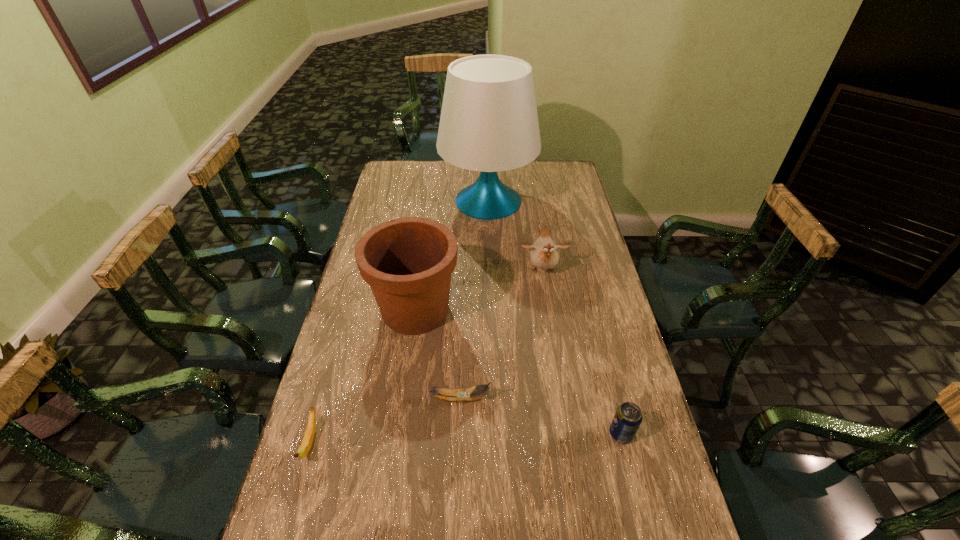
At what (x,y) coordinates should I click in order to perform the action: click on vacant point located between the fourth tallest object and the right banana. Please return your answer as a coordinate pair (x, y). This screenshot has width=960, height=540. Looking at the image, I should click on 540,416.

Identify the location of free space between the fifth shortest object and the left banana. The image size is (960, 540). (363, 376).

This screenshot has height=540, width=960. I want to click on vacant space that is in between the leftmost object and the bird, so click(426, 357).

This screenshot has height=540, width=960. What are the coordinates of `vacant area that lies between the bird and the fourth tallest object` in the screenshot? It's located at (582, 353).

The height and width of the screenshot is (540, 960). I want to click on vacant region between the shortest object and the fourth shortest object, so click(426, 357).

Where is `object that stands as the fifth closest to the tallest object`? object that stands as the fifth closest to the tallest object is located at coordinates (306, 444).

Choose which object is the nearest neighbor to the shorter banana. Please provide its 2D coordinates. Your answer should be formatted as a tuple, i.e. [(x, y)], where the tuple contains the x and y coordinates of a point satisfying the conditions above.

[(408, 262)]

This screenshot has height=540, width=960. I want to click on vacant point that satisfies the following two spatial constraints: 1. on the front side of the flowerpot; 2. on the right side of the fourth tallest object, so click(397, 434).

This screenshot has width=960, height=540. In order to click on free space that satisfies the following two spatial constraints: 1. on the front side of the third shortest object; 2. on the left side of the second tallest object in this screenshot , I will do `click(397, 434)`.